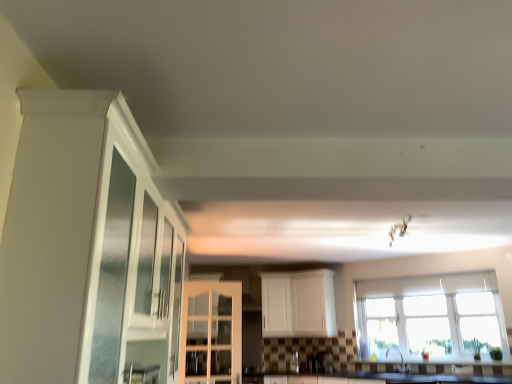
Question: Is satin nickel faucet at lower center in front of or behind clear glass window at center in the image?

Choices:
 (A) behind
 (B) front

Answer: (A)

Question: Is satin nickel faucet at lower center wider or thinner than clear glass window at center?

Choices:
 (A) thin
 (B) wide

Answer: (B)

Question: Which object is the closest to the white glossy cabinet at center, marked as the second cabinetry in a front-to-back arrangement?

Choices:
 (A) white matte cabinet at center, which is counted as the 1th cabinetry, starting from the back
 (B) satin nickel faucet at lower center
 (C) white glossy cabinet at left, acting as the third cabinetry starting from the back
 (D) metallic glass bottle at center
 (E) clear glass window at center

Answer: (A)

Question: Estimate the real-world distances between objects in this image. Which object is closer to the white matte cabinet at center, which is counted as the third cabinetry, starting from the front?

Choices:
 (A) satin nickel faucet at lower center
 (B) white glossy cabinet at left, acting as the third cabinetry starting from the back
 (C) metallic glass bottle at center
 (D) clear glass window at center
 (E) white glossy cabinet at center, marked as the second cabinetry in a front-to-back arrangement

Answer: (C)